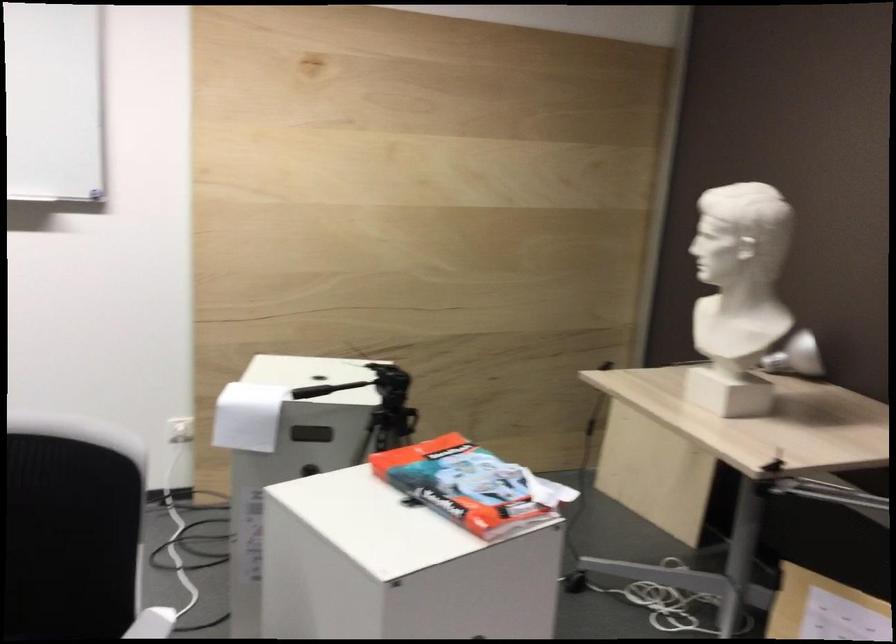
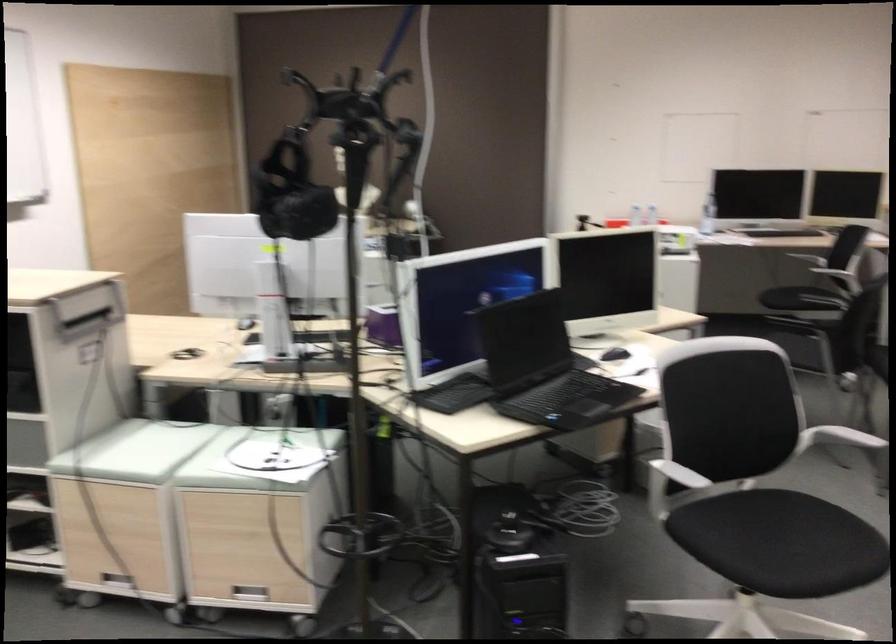
Question: I am providing you with two images of the same scene from different viewpoints. Which of the following objects are not visible in image2?

Choices:
 (A) black computer mouse
 (B) white weighing scale
 (C) tripod adjustment handle
 (D) white chair armrest

Answer: (C)